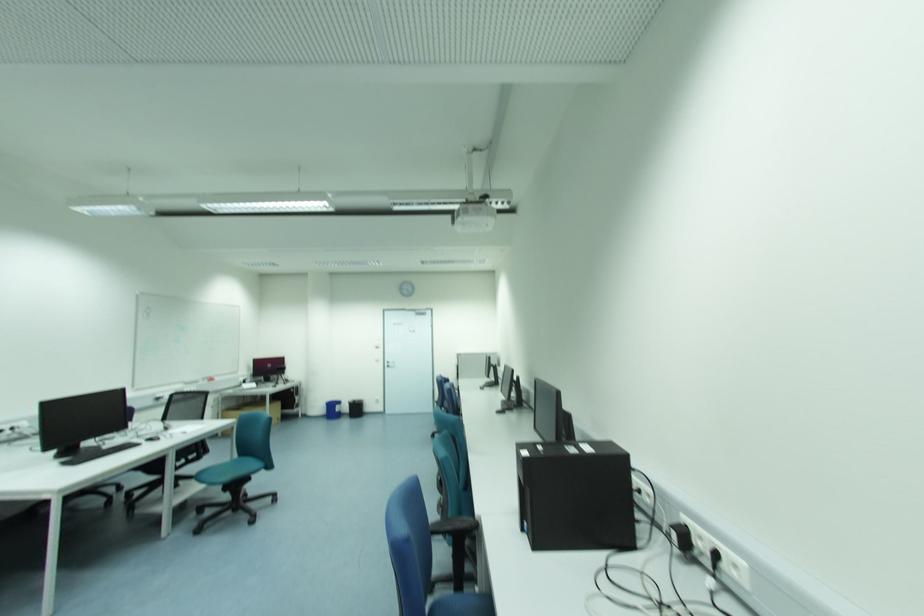
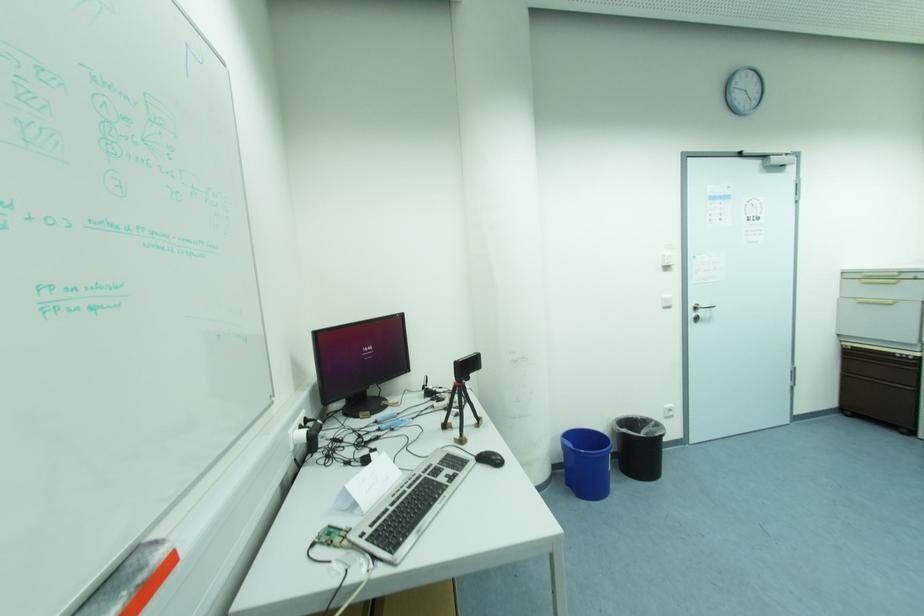
Find the pixel in the second image that matches point (388, 363) in the first image.

(697, 309)